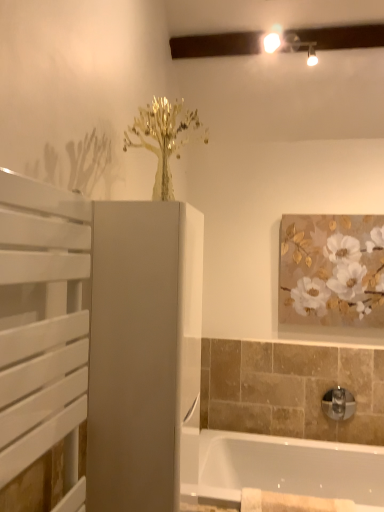
What is the approximate height of beige cotton towel at lower center?

beige cotton towel at lower center is 5.31 inches in height.

What do you see at coordinates (42, 338) in the screenshot? Image resolution: width=384 pixels, height=512 pixels. I see `white slatted screen door at left, the 2th screen door in the back-to-front sequence` at bounding box center [42, 338].

The image size is (384, 512). Identify the location of gold textured painting at upper right. 331,270.

The image size is (384, 512). What do you see at coordinates (277, 468) in the screenshot? I see `white glossy bathtub at lower right` at bounding box center [277, 468].

You are a GUI agent. You are given a task and a screenshot of the screen. Output one action in this format:
    pyautogui.click(x=<x>, y=<y>)
    Task: Click on the beige cotton towel at lower center
    This screenshot has height=512, width=384.
    Given the screenshot: What is the action you would take?
    pyautogui.click(x=290, y=502)

Locate an element on the screen. Image resolution: width=384 pixels, height=512 pixels. the 1st screen door located beneath the gold textured painting at upper right (from a real-world perspective) is located at coordinates (42, 338).

Considering the relative positions of gold textured painting at upper right and white slatted screen door at left, the 1th screen door from the left, in the image provided, is gold textured painting at upper right to the right of white slatted screen door at left, the 1th screen door from the left, from the viewer's perspective?

Yes.

Is white slatted screen door at left, the 2th screen door when ordered from right to left, a part of gold textured painting at upper right?

No, gold textured painting at upper right does not contain white slatted screen door at left, the 2th screen door when ordered from right to left.

In the scene shown: Which of these two, chrome metallic tap at lower right or gold textured painting at upper right, stands taller?

gold textured painting at upper right is taller.

Does point (349, 392) come behind point (372, 317)?

Yes.

From the image's perspective, between chrome metallic tap at lower right and gold textured painting at upper right, which one is located above?

gold textured painting at upper right is shown above in the image.

Is chrome metallic tap at lower right oriented away from gold textured painting at upper right?

No, chrome metallic tap at lower right is not facing the opposite direction of gold textured painting at upper right.

Between matte white cabinet at center, the first screen door when ordered from right to left, and chrome metallic tap at lower right, which one has larger size?

matte white cabinet at center, the first screen door when ordered from right to left, is bigger.

Between matte white cabinet at center, the first screen door when ordered from right to left, and chrome metallic tap at lower right, which one has smaller width?

chrome metallic tap at lower right.

From the image's perspective, which is above, matte white cabinet at center, which appears as the 1th screen door when viewed from the back, or chrome metallic tap at lower right?

From the image's view, matte white cabinet at center, which appears as the 1th screen door when viewed from the back, is above.

Is matte white cabinet at center, the 2th screen door from the left, inside beige cotton towel at lower center?

No, beige cotton towel at lower center does not contain matte white cabinet at center, the 2th screen door from the left.

Looking at this image, from a real-world perspective, who is located higher, beige cotton towel at lower center or matte white cabinet at center, which appears as the 1th screen door when viewed from the back?

In real-world perspective, matte white cabinet at center, which appears as the 1th screen door when viewed from the back, is above.

From the picture: Considering the sizes of objects beige cotton towel at lower center and matte white cabinet at center, the 2th screen door viewed from the front, in the image provided, who is shorter, beige cotton towel at lower center or matte white cabinet at center, the 2th screen door viewed from the front,?

Standing shorter between the two is beige cotton towel at lower center.

Considering the sizes of objects beige cotton towel at lower center and matte white cabinet at center, the 2th screen door viewed from the front, in the image provided, who is smaller, beige cotton towel at lower center or matte white cabinet at center, the 2th screen door viewed from the front,?

Smaller between the two is beige cotton towel at lower center.

Is gold textured painting at upper right in front of matte white cabinet at center, the first screen door when ordered from right to left?

No, gold textured painting at upper right is further to the viewer.

Based on their positions, is gold textured painting at upper right located to the left or right of matte white cabinet at center, the 2th screen door from the left?

In the image, gold textured painting at upper right appears on the right side of matte white cabinet at center, the 2th screen door from the left.

What's the angular difference between gold textured painting at upper right and matte white cabinet at center, which appears as the 1th screen door when viewed from the back,'s facing directions?

They differ by 89.8 degrees in their facing directions.

At what (x,y) coordinates should I click in order to perform the action: click on picture frame above the matte white cabinet at center, which appears as the 1th screen door when viewed from the back (from the image's perspective). Please return your answer as a coordinate pair (x, y). This screenshot has width=384, height=512. Looking at the image, I should click on (331, 270).

Is chrome metallic tap at lower right at the back of white glossy bathtub at lower right?

No, white glossy bathtub at lower right's orientation is not away from chrome metallic tap at lower right.

Considering the relative sizes of white glossy bathtub at lower right and chrome metallic tap at lower right in the image provided, is white glossy bathtub at lower right taller than chrome metallic tap at lower right?

Indeed, white glossy bathtub at lower right has a greater height compared to chrome metallic tap at lower right.

Are white glossy bathtub at lower right and chrome metallic tap at lower right beside each other?

white glossy bathtub at lower right and chrome metallic tap at lower right are clearly separated.

At what (x,y) coordinates should I click in order to perform the action: click on tap lying behind the white glossy bathtub at lower right. Please return your answer as a coordinate pair (x, y). This screenshot has width=384, height=512. Looking at the image, I should click on (338, 404).

Is gold textured painting at upper right inside the boundaries of white glossy bathtub at lower right, or outside?

gold textured painting at upper right is not inside white glossy bathtub at lower right, it's outside.

This screenshot has width=384, height=512. What are the coordinates of `picture frame located above the white glossy bathtub at lower right (from a real-world perspective)` in the screenshot? It's located at (331, 270).

Is gold textured painting at upper right oriented towards white glossy bathtub at lower right?

No, gold textured painting at upper right is not oriented towards white glossy bathtub at lower right.

Find the location of a particular element. screen door that is the 2nd one when counting forward from the gold textured painting at upper right is located at coordinates (42, 338).

You are a GUI agent. You are given a task and a screenshot of the screen. Output one action in this format:
    pyautogui.click(x=<x>, y=<y>)
    Task: Click on the tap lying below the gold textured painting at upper right (from the image's perspective)
    The height and width of the screenshot is (512, 384).
    Given the screenshot: What is the action you would take?
    pyautogui.click(x=338, y=404)

Considering their positions, is beige cotton towel at lower center positioned further to white slatted screen door at left, the 2th screen door when ordered from right to left, than gold textured painting at upper right?

gold textured painting at upper right is positioned further to the anchor white slatted screen door at left, the 2th screen door when ordered from right to left.

Considering their positions, is white glossy bathtub at lower right positioned closer to white slatted screen door at left, the 2th screen door in the back-to-front sequence, than matte white cabinet at center, the 2th screen door from the left?

Among the two, matte white cabinet at center, the 2th screen door from the left, is located nearer to white slatted screen door at left, the 2th screen door in the back-to-front sequence.

Looking at the image, which one is located further to white slatted screen door at left, the 2th screen door in the back-to-front sequence, white glossy bathtub at lower right or beige cotton towel at lower center?

white glossy bathtub at lower right.

Based on their spatial positions, is chrome metallic tap at lower right or gold textured painting at upper right closer to white slatted screen door at left, the 2th screen door when ordered from right to left?

gold textured painting at upper right is positioned closer to the anchor white slatted screen door at left, the 2th screen door when ordered from right to left.

Looking at the image, which one is located closer to gold textured painting at upper right, chrome metallic tap at lower right or white glossy bathtub at lower right?

chrome metallic tap at lower right is positioned closer to the anchor gold textured painting at upper right.

Looking at the image, which one is located further to beige cotton towel at lower center, matte white cabinet at center, which appears as the 1th screen door when viewed from the back, or chrome metallic tap at lower right?

matte white cabinet at center, which appears as the 1th screen door when viewed from the back, lies further to beige cotton towel at lower center than the other object.

In the scene shown: Considering their positions, is chrome metallic tap at lower right positioned further to matte white cabinet at center, the 2th screen door viewed from the front, than white slatted screen door at left, the 1th screen door from the left?

chrome metallic tap at lower right.

Considering their positions, is white slatted screen door at left, the 1th screen door from the left, positioned closer to chrome metallic tap at lower right than matte white cabinet at center, the first screen door when ordered from right to left?

matte white cabinet at center, the first screen door when ordered from right to left, is positioned closer to the anchor chrome metallic tap at lower right.

Locate an element on the screen. bath towel between matte white cabinet at center, the 2th screen door from the left, and gold textured painting at upper right in the front-back direction is located at coordinates (290, 502).

Locate an element on the screen. The image size is (384, 512). bathtub positioned between white slatted screen door at left, the 2th screen door when ordered from right to left, and gold textured painting at upper right from near to far is located at coordinates pos(277,468).

Identify the location of bathtub located between beige cotton towel at lower center and chrome metallic tap at lower right in the depth direction. Image resolution: width=384 pixels, height=512 pixels. (277, 468).

The height and width of the screenshot is (512, 384). Identify the location of bath towel that lies between gold textured painting at upper right and white glossy bathtub at lower right from top to bottom. (290, 502).